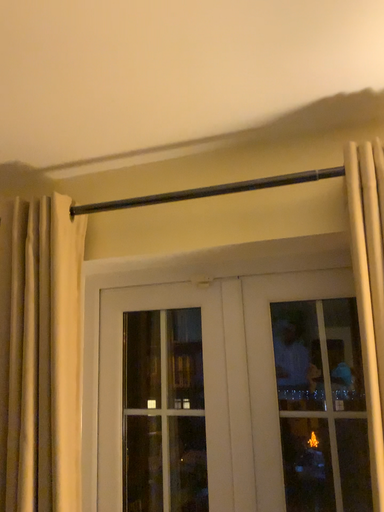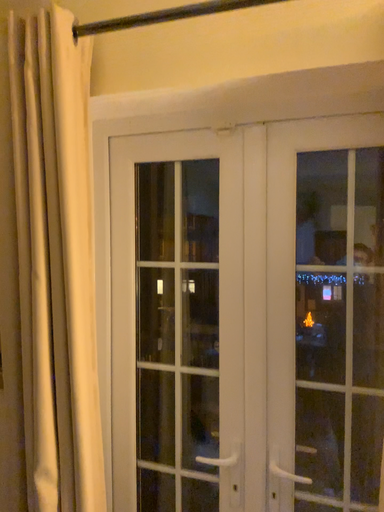
Question: How did the camera likely rotate when shooting the video?

Choices:
 (A) rotated upward
 (B) rotated downward

Answer: (B)